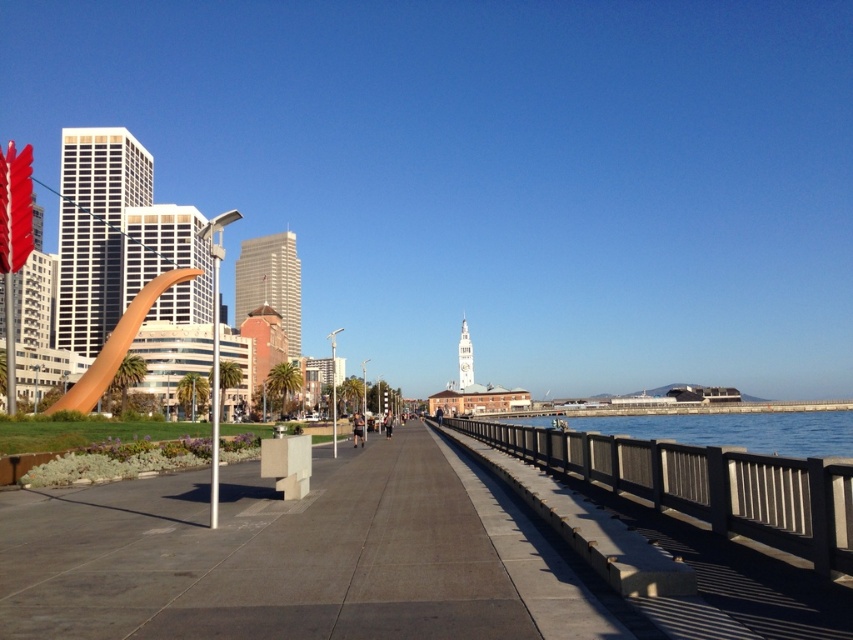
Question: Which of the following is the closest to the observer?

Choices:
 (A) clear blue water at right
 (B) brown wooden rail at right

Answer: (B)

Question: Is brown wooden rail at right wider than clear blue water at right?

Choices:
 (A) yes
 (B) no

Answer: (B)

Question: Is brown wooden rail at right wider than clear blue water at right?

Choices:
 (A) yes
 (B) no

Answer: (B)

Question: Is brown wooden rail at right to the left of clear blue water at right from the viewer's perspective?

Choices:
 (A) no
 (B) yes

Answer: (B)